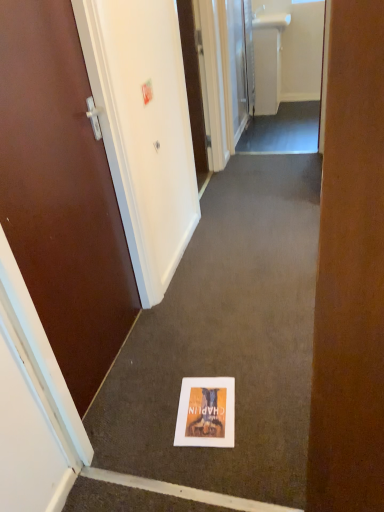
Identify the location of blank space situated above matte paper flyer at center (from a real-world perspective). The image size is (384, 512). (206, 408).